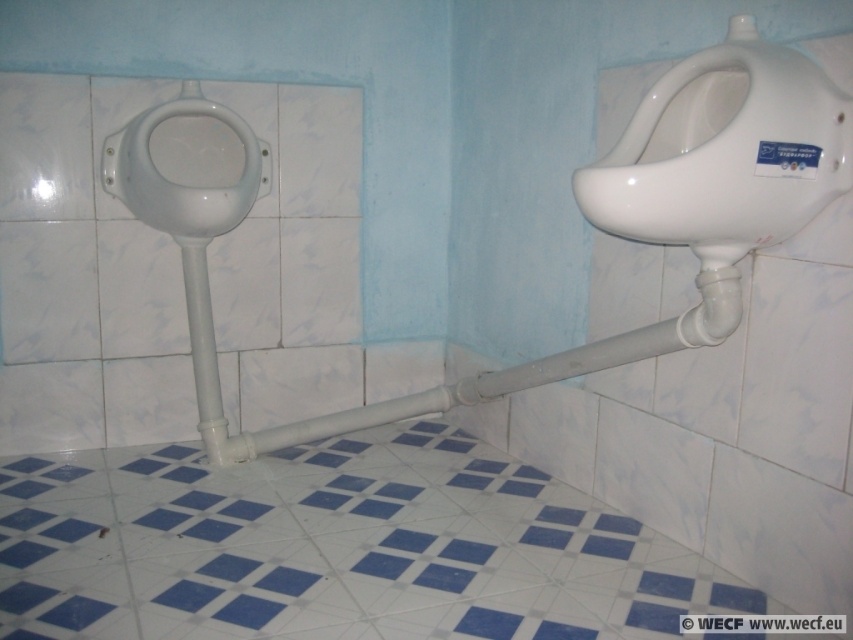
Which is more to the right, white glossy pipe at center or white glossy bidet at left?

From the viewer's perspective, white glossy pipe at center appears more on the right side.

Who is higher up, white glossy pipe at center or white glossy bidet at left?

Positioned higher is white glossy bidet at left.

Who is more distant from viewer, (262, 452) or (155, 108)?

Point (262, 452)

At what (x,y) coordinates should I click in order to perform the action: click on white glossy pipe at center. Please return your answer as a coordinate pair (x, y). This screenshot has height=640, width=853. Looking at the image, I should click on (460, 380).